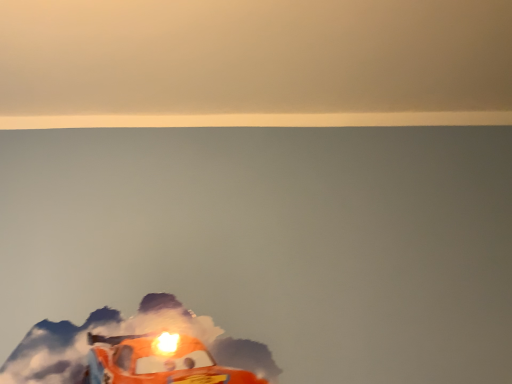
The image size is (512, 384). Find the location of `matte orange car at bottom`. matte orange car at bottom is located at coordinates (254, 63).

In order to face matte orange car at bottom, should I rotate leftwards or rightwards?

A 0.822 degree turn to the left will do.

This screenshot has height=384, width=512. Describe the element at coordinates (254, 63) in the screenshot. I see `matte orange car at bottom` at that location.

Locate an element on the screen. matte orange car at bottom is located at coordinates (254, 63).